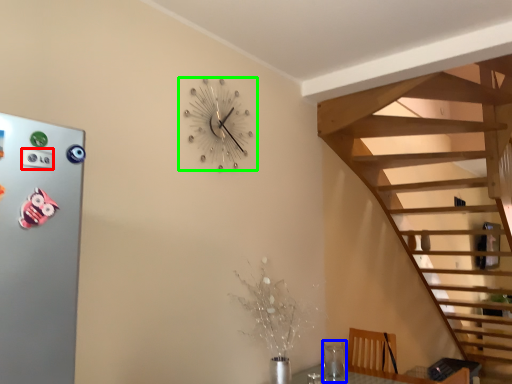
Question: Estimate the real-world distances between objects in this image. Which object is farther from button (highlighted by a red box), glass vase (highlighted by a blue box) or wall clock (highlighted by a green box)?

Choices:
 (A) glass vase
 (B) wall clock

Answer: (A)